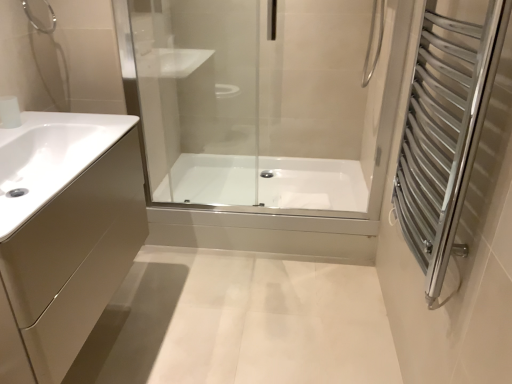
Question: Is white glossy sink at left wider or thinner than matte beige cabinet at left?

Choices:
 (A) thin
 (B) wide

Answer: (A)

Question: Considering their positions, is white glossy sink at left located in front of or behind matte beige cabinet at left?

Choices:
 (A) front
 (B) behind

Answer: (A)

Question: Considering the real-world distances, which object is closest to the silver metallic towel rack at right?

Choices:
 (A) white glossy bathtub at center
 (B) matte beige cabinet at left
 (C) brushed metal shower at upper left
 (D) transparent glass shower door at center
 (E) white glossy sink at left

Answer: (D)

Question: Which object is the farthest from the white glossy sink at left?

Choices:
 (A) white glossy bathtub at center
 (B) brushed metal shower at upper left
 (C) silver metallic towel rack at right
 (D) matte beige cabinet at left
 (E) white glossy faucet at upper left

Answer: (A)